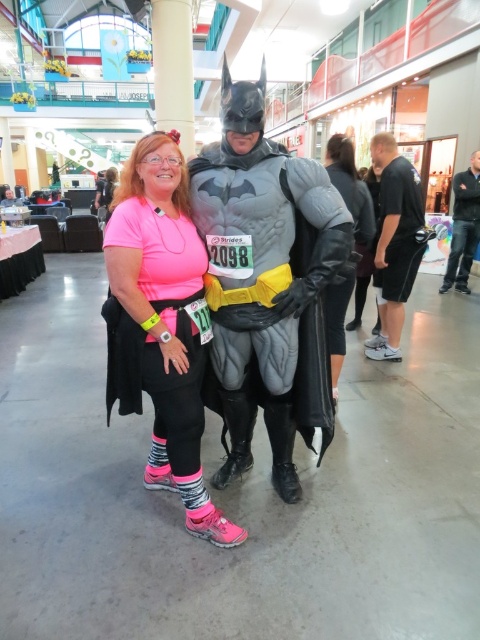
Is neon pink fabric leggings at center above leather jacket at right?

Correct, neon pink fabric leggings at center is located above leather jacket at right.

Which is in front, point (132, 330) or point (325, 161)?

Point (132, 330) is in front.

At what (x,y) coordinates should I click in order to perform the action: click on neon pink fabric leggings at center. Please return your answer as a coordinate pair (x, y). Image resolution: width=480 pixels, height=640 pixels. Looking at the image, I should click on (165, 320).

Is leather jacket at right below black leather jacket at right?

Indeed, leather jacket at right is positioned under black leather jacket at right.

Which is behind, point (340, 312) or point (476, 237)?

The point (476, 237) is behind.

Locate an element on the screen. The width and height of the screenshot is (480, 640). leather jacket at right is located at coordinates (350, 186).

Is point (162, 246) behind point (472, 205)?

No, it is not.

Can you confirm if neon pink fabric leggings at center is positioned to the left of black leather jacket at right?

Correct, you'll find neon pink fabric leggings at center to the left of black leather jacket at right.

Measure the distance between point (156,385) and camera.

Point (156,385) is 5.96 feet from camera.

Find the location of `neon pink fabric leggings at center`. neon pink fabric leggings at center is located at coordinates (165, 320).